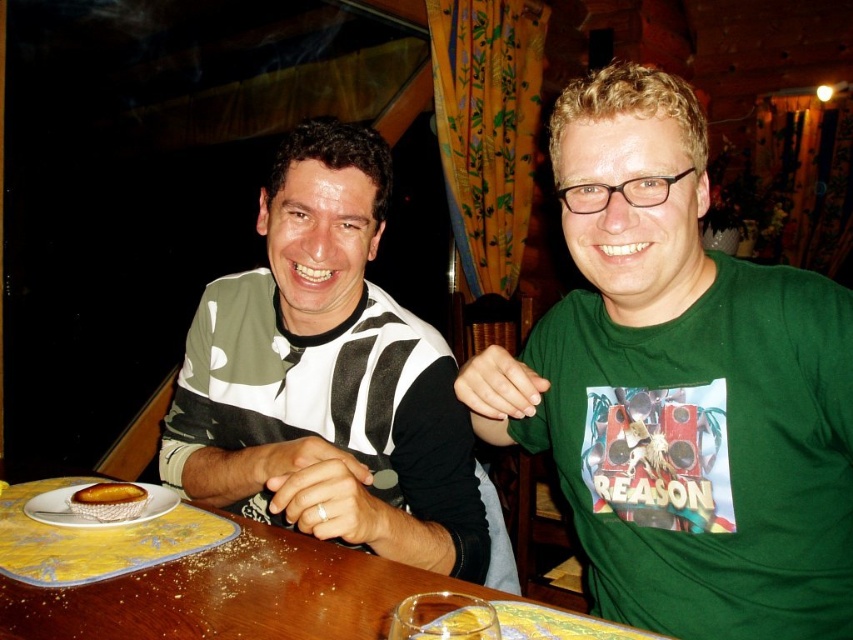
You are sitting at the wooden table at center and want to reach the striped jersey at center. Can you comfortably reach it without moving your chair?

The striped jersey at center is further to the viewer than wooden table at center, meaning it is closer to you. Therefore, you can comfortably reach it without moving your chair.

You are sitting at the table in the image and want to reach both the point at coordinates point [409,531] and point [189,536]. Which point will your hand touch first?

The point at coordinates point [409,531] will be touched first because it is closer to you than the other point.